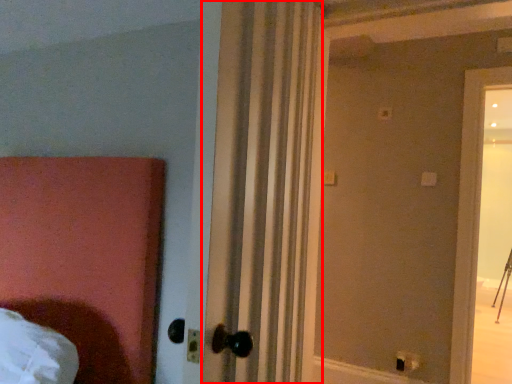
Question: From the image's perspective, where is curtain (annotated by the red box) located relative to electric outlet?

Choices:
 (A) above
 (B) below

Answer: (A)